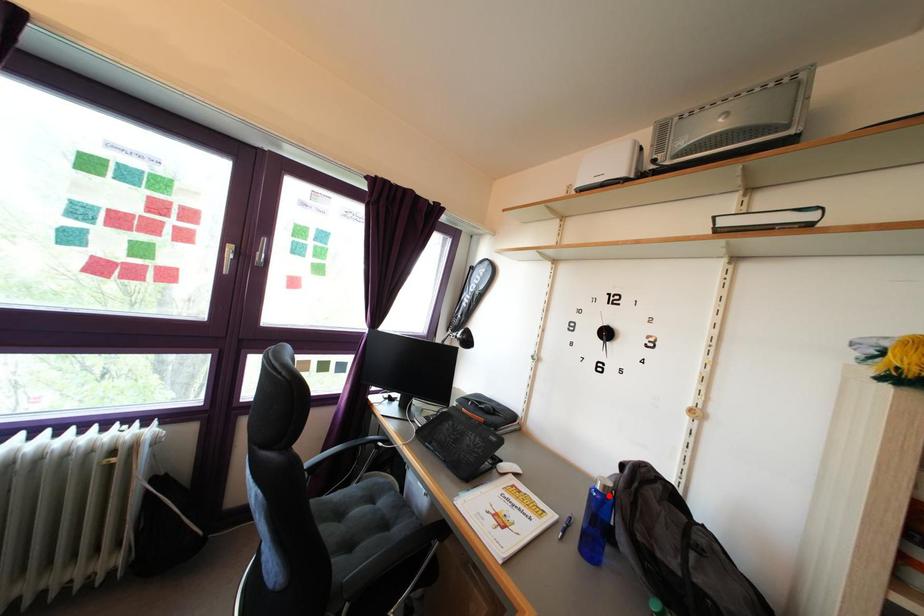
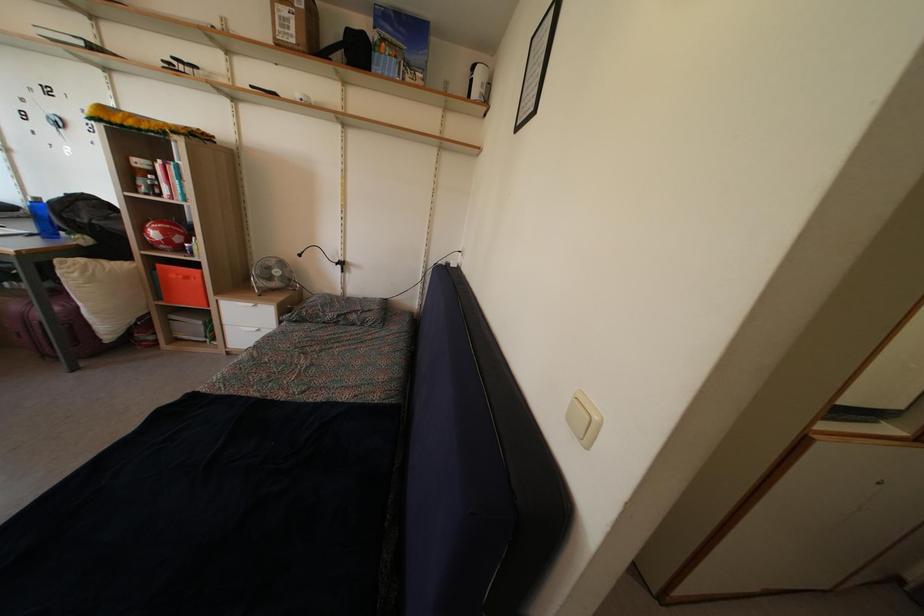
Find the pixel in the second image that matches the highlighted location in the first image.

(40, 208)